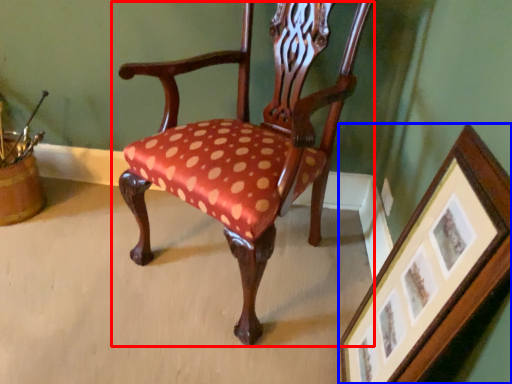
Question: Among these objects, which one is nearest to the camera, chair (highlighted by a red box) or picture frame (highlighted by a blue box)?

Choices:
 (A) chair
 (B) picture frame

Answer: (B)